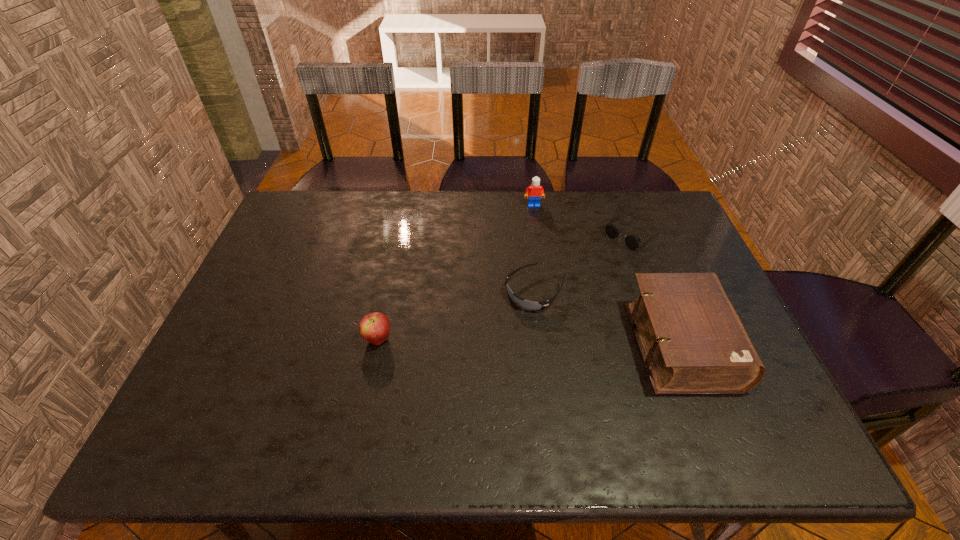
This screenshot has width=960, height=540. I want to click on the fourth closest object to the farthest object, so click(x=375, y=328).

This screenshot has height=540, width=960. In order to click on vacant region that satisfies the following two spatial constraints: 1. on the front side of the Bible; 2. on the spine side of the apple in this screenshot , I will do `click(376, 345)`.

Identify the location of free space that satisfies the following two spatial constraints: 1. on the back side of the farther sunglasses; 2. on the left side of the leftmost object. (399, 233).

I want to click on free location that satisfies the following two spatial constraints: 1. on the front side of the fourth nearest object; 2. on the left side of the farthest object, so click(538, 233).